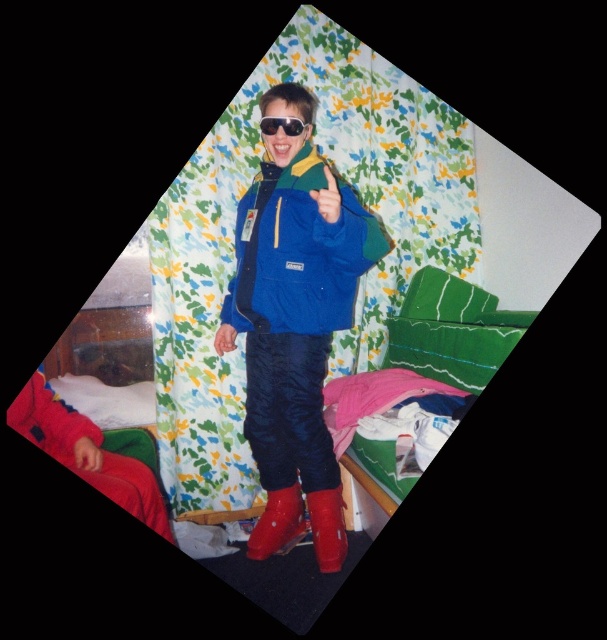
You are standing in the room and see the point marked at coordinates (x=293, y=310). What object is located exactly at that point?

The matte blue jacket at center is located exactly at point (x=293, y=310).

You are a fashion designer observing the image. You need to determine which item, the matte blue jacket at center or the rubber boots at center, would require more fabric to produce based on their size. Which one would need more fabric?

The matte blue jacket at center is larger in size than the rubber boots at center, so it would require more fabric to produce.